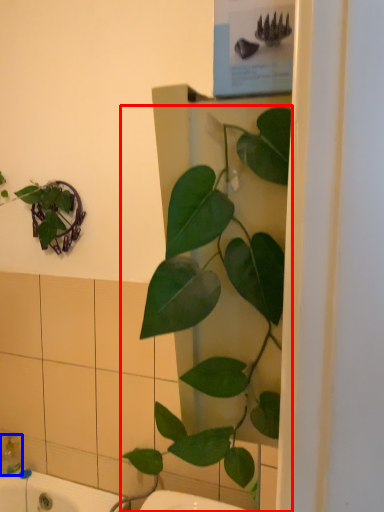
Question: Among these objects, which one is nearest to the camera, houseplant (highlighted by a red box) or soap dispenser (highlighted by a blue box)?

Choices:
 (A) houseplant
 (B) soap dispenser

Answer: (A)